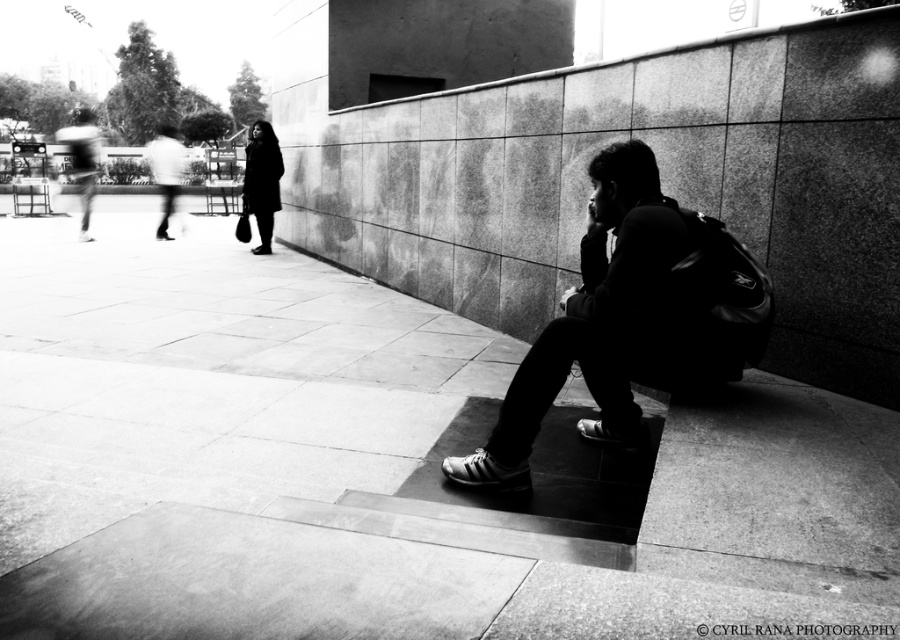
Can you confirm if smooth concrete pavement at center is shorter than black leather backpack at center?

Yes, smooth concrete pavement at center is shorter than black leather backpack at center.

Which of these two, smooth concrete pavement at center or black leather backpack at center, stands shorter?

Standing shorter between the two is smooth concrete pavement at center.

Which is behind, point (189, 449) or point (599, 172)?

The point (189, 449) is behind.

Identify the location of smooth concrete pavement at center. This screenshot has width=900, height=640. (385, 468).